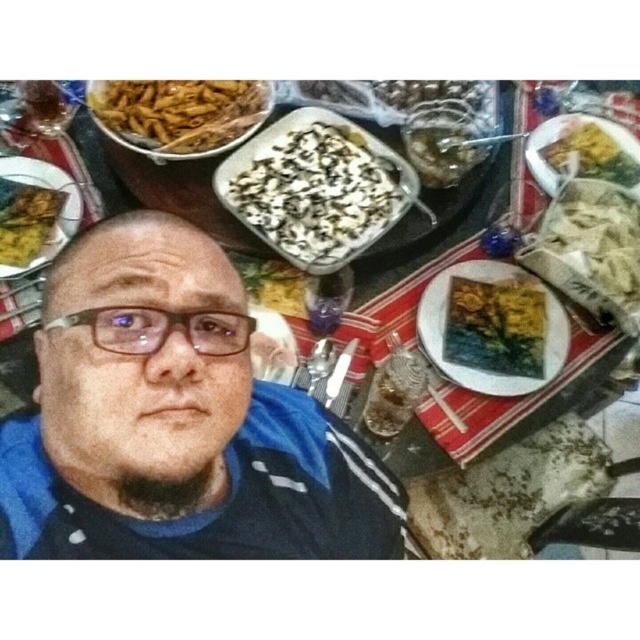
You are a food photographer setting up a shot. You have a brown matte pasta at upper left and a slightly translucent glass bowl at center. Which object should you focus on if you want to capture the wider subject?

The brown matte pasta at upper left is wider than the slightly translucent glass bowl at center, so you should focus on the brown matte pasta at upper left to capture the wider subject.

You are trying to place a small decorative item on the table in the image. The item must be placed exactly at the coordinates given for the white matte noodles at right. Where should you place it relative to the noodles?

The white matte noodles at right are already at the coordinates specified, so the item should be placed exactly where the white matte noodles at right are located.

You are setting up a table for a photo shoot and need to arrange items based on their sizes. The yellow painted wood plate at center and transparent plastic glasses at center are both at the center of the table. Which item should you place first if you want to ensure the smaller item is placed on top?

The transparent plastic glasses at center should be placed first since the yellow painted wood plate at center is wider, meaning the smaller transparent plastic glasses can be placed on top of it.